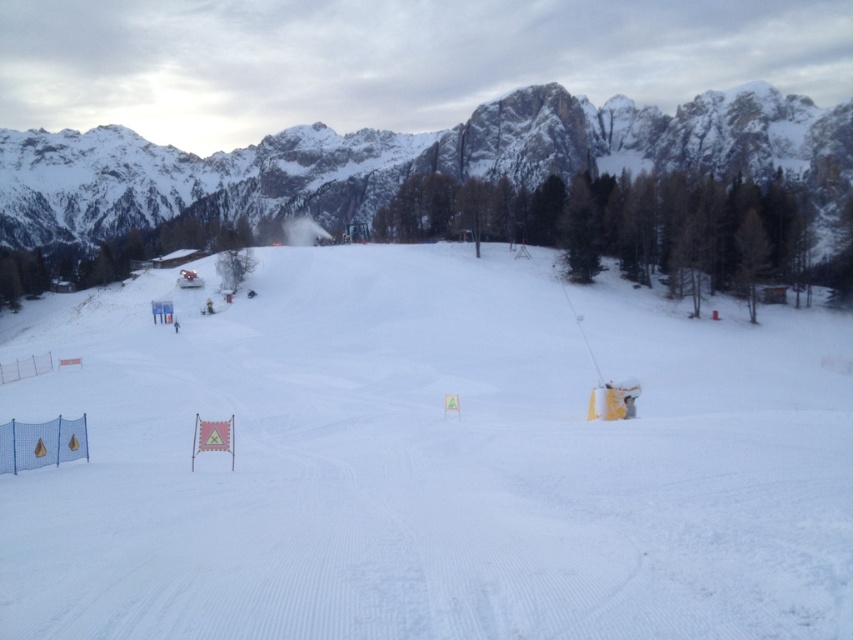
You are a ski instructor planning a beginner lesson. You want to ensure safety by keeping the group on the slope with white powdery snow at center. The snowy granite mountain at upper center is a potential hazard. Based on their positions, can you guide the group to stay clear of the mountain?

The white powdery snow at center is positioned under the snowy granite mountain at upper center, so to avoid the mountain, the group should stay on the lower part of the slope where the white powdery snow at center is located, away from the upper area near the mountain.

You are a skier planning your descent down the slope. You notice the white powdery snow at center and the snowy granite mountain at upper center. Which direction should you head to avoid the mountain?

You should head to the left to avoid the snowy granite mountain at upper center because the white powdery snow at center is located to the right of the mountain.

You are planning to take a photo of the white powdery snow at center and the snowy granite mountain at upper center. Which object will appear larger in the photo?

The white powdery snow at center appears larger in the photo because it is closer to the camera than the snowy granite mountain at upper center, which is farther away and thus smaller in the frame.